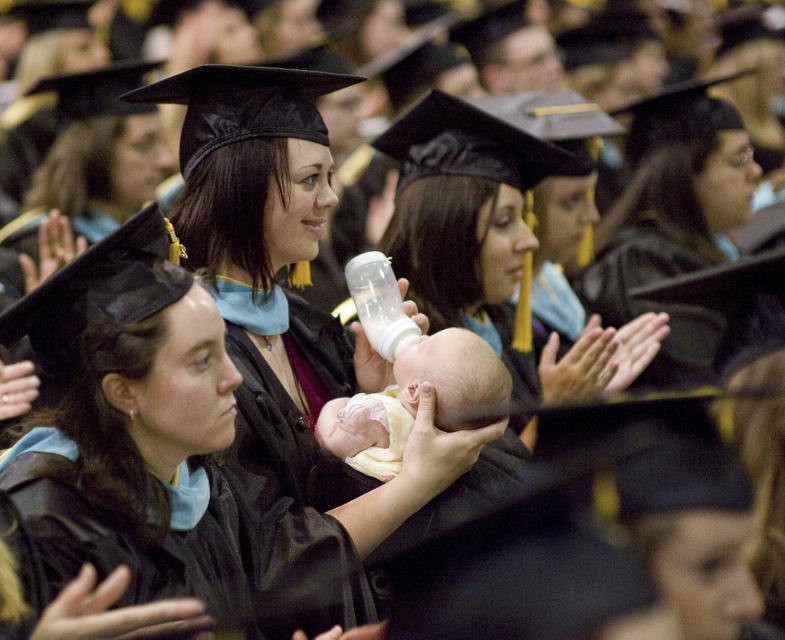
Question: Estimate the real-world distances between objects in this image. Which object is farther from the soft white skin at center?

Choices:
 (A) matte black graduation cap at center
 (B) transparent plastic baby bottle at center

Answer: (A)

Question: Is matte black graduation cap at center smaller than soft white skin at center?

Choices:
 (A) yes
 (B) no

Answer: (B)

Question: Estimate the real-world distances between objects in this image. Which object is closer to the soft white skin at center?

Choices:
 (A) transparent plastic baby bottle at center
 (B) matte black graduation cap at center

Answer: (A)

Question: Can you confirm if matte black graduation cap at center is thinner than transparent plastic baby bottle at center?

Choices:
 (A) yes
 (B) no

Answer: (B)

Question: Which point is closer to the camera?

Choices:
 (A) (685, 141)
 (B) (369, 305)

Answer: (B)

Question: Does matte black graduation cap at center have a smaller size compared to transparent plastic baby bottle at center?

Choices:
 (A) no
 (B) yes

Answer: (A)